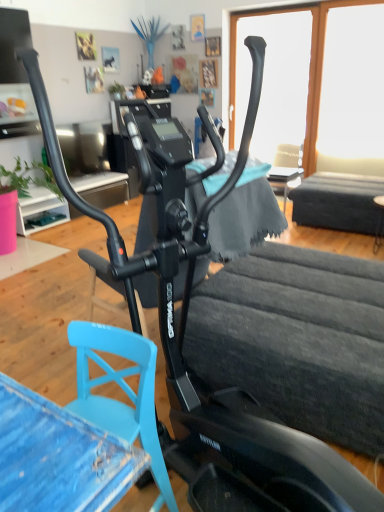
Question: Is transparent glass window at upper right, which is the first window screen in right-to-left order, in front of black matte table at lower right, which is counted as the 1th table, starting from the front?

Choices:
 (A) no
 (B) yes

Answer: (A)

Question: Is transparent glass window at upper right, which is the first window screen in right-to-left order, at the right side of black matte table at lower right, which is counted as the 1th table, starting from the front?

Choices:
 (A) yes
 (B) no

Answer: (A)

Question: Can you confirm if transparent glass window at upper right, which is the first window screen in right-to-left order, is wider than black matte table at lower right, the second table from the back?

Choices:
 (A) no
 (B) yes

Answer: (A)

Question: Is transparent glass window at upper right, the second window screen viewed from the left, oriented away from black matte table at lower right, the second table from the back?

Choices:
 (A) no
 (B) yes

Answer: (A)

Question: Is transparent glass window at upper right, the second window screen viewed from the left, not close to black matte table at lower right, which is counted as the 1th table, starting from the front?

Choices:
 (A) yes
 (B) no

Answer: (A)

Question: Is point (362, 210) closer or farther from the camera than point (243, 14)?

Choices:
 (A) closer
 (B) farther

Answer: (A)

Question: From the image's perspective, is smooth wooden table at right, positioned as the 2th table in front-to-back order, positioned above or below transparent glass window at upper center, which appears as the first window screen when viewed from the left?

Choices:
 (A) below
 (B) above

Answer: (A)

Question: Considering the positions of smooth wooden table at right, the 1th table when ordered from back to front, and transparent glass window at upper center, arranged as the 2th window screen when viewed from the right, in the image, is smooth wooden table at right, the 1th table when ordered from back to front, wider or thinner than transparent glass window at upper center, arranged as the 2th window screen when viewed from the right,?

Choices:
 (A) wide
 (B) thin

Answer: (A)

Question: Looking at the image, does smooth wooden table at right, the 1th table when ordered from back to front, seem bigger or smaller compared to transparent glass window at upper center, arranged as the 2th window screen when viewed from the right?

Choices:
 (A) small
 (B) big

Answer: (B)

Question: Considering the positions of transparent glass window at upper right, which is the first window screen in right-to-left order, and black matte table at lower right, which is counted as the 1th table, starting from the front, in the image, is transparent glass window at upper right, which is the first window screen in right-to-left order, bigger or smaller than black matte table at lower right, which is counted as the 1th table, starting from the front,?

Choices:
 (A) big
 (B) small

Answer: (A)

Question: Which is correct: transparent glass window at upper right, the second window screen viewed from the left, is inside black matte table at lower right, which is counted as the 1th table, starting from the front, or outside of it?

Choices:
 (A) inside
 (B) outside

Answer: (B)

Question: From the image's perspective, is transparent glass window at upper right, which is the first window screen in right-to-left order, positioned above or below black matte table at lower right, the second table from the back?

Choices:
 (A) below
 (B) above

Answer: (B)

Question: From a real-world perspective, is transparent glass window at upper right, the second window screen viewed from the left, physically located above or below black matte table at lower right, the second table from the back?

Choices:
 (A) below
 (B) above

Answer: (B)

Question: From a real-world perspective, is black matte table at lower right, which is counted as the 1th table, starting from the front, physically located above or below soft blue cloth at center?

Choices:
 (A) above
 (B) below

Answer: (B)

Question: In the image, is black matte table at lower right, which is counted as the 1th table, starting from the front, positioned in front of or behind soft blue cloth at center?

Choices:
 (A) behind
 (B) front

Answer: (A)